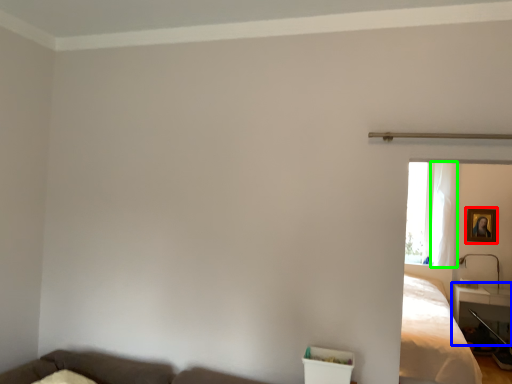
Question: Which is nearer to the picture frame (highlighted by a red box)? table (highlighted by a blue box) or curtain (highlighted by a green box).

Choices:
 (A) table
 (B) curtain

Answer: (B)